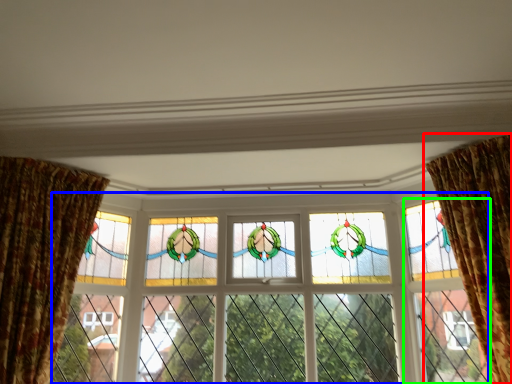
Question: Which object is the farthest from curtain (highlighted by a red box)? Choose among these: window (highlighted by a blue box) or glass door (highlighted by a green box).

Choices:
 (A) window
 (B) glass door

Answer: (A)